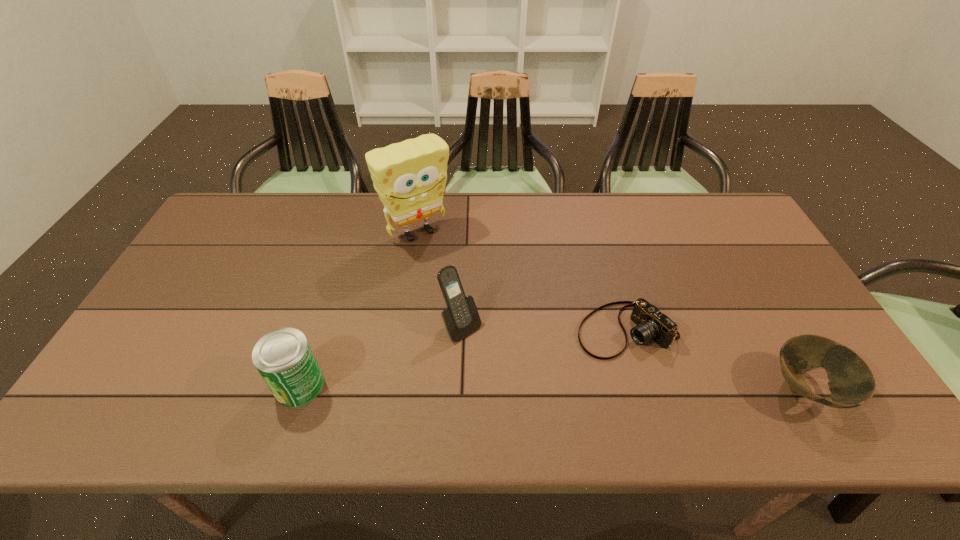
Locate an element on the screen. free space at the far right corner is located at coordinates (742, 229).

Where is `vacant space in between the fourth shortest object and the leftmost object`? The width and height of the screenshot is (960, 540). vacant space in between the fourth shortest object and the leftmost object is located at coordinates (380, 356).

Identify the location of empty space between the fourth shortest object and the rightmost object. Image resolution: width=960 pixels, height=540 pixels. (634, 358).

Where is `blank region between the tallest object and the fourth object from left to right`? blank region between the tallest object and the fourth object from left to right is located at coordinates (521, 281).

At what (x,y) coordinates should I click in order to perform the action: click on vacant point located between the tallest object and the bowl. Please return your answer as a coordinate pair (x, y). The height and width of the screenshot is (540, 960). Looking at the image, I should click on (612, 310).

Locate an element on the screen. This screenshot has width=960, height=540. unoccupied position between the bowl and the second object from right to left is located at coordinates (716, 360).

Find the location of a particular element. This screenshot has height=540, width=960. free area in between the third shortest object and the sponge is located at coordinates (358, 308).

You are a GUI agent. You are given a task and a screenshot of the screen. Output one action in this format:
    pyautogui.click(x=<x>, y=<y>)
    Task: Click on the empty space that is in between the farthest object and the bowl
    This screenshot has width=960, height=540.
    Given the screenshot: What is the action you would take?
    pyautogui.click(x=612, y=310)

Find the location of a particular element. This screenshot has height=540, width=960. empty space between the second object from right to left and the fourth tallest object is located at coordinates (716, 360).

The width and height of the screenshot is (960, 540). Identify the location of free point between the second object from right to left and the second shortest object. (716, 360).